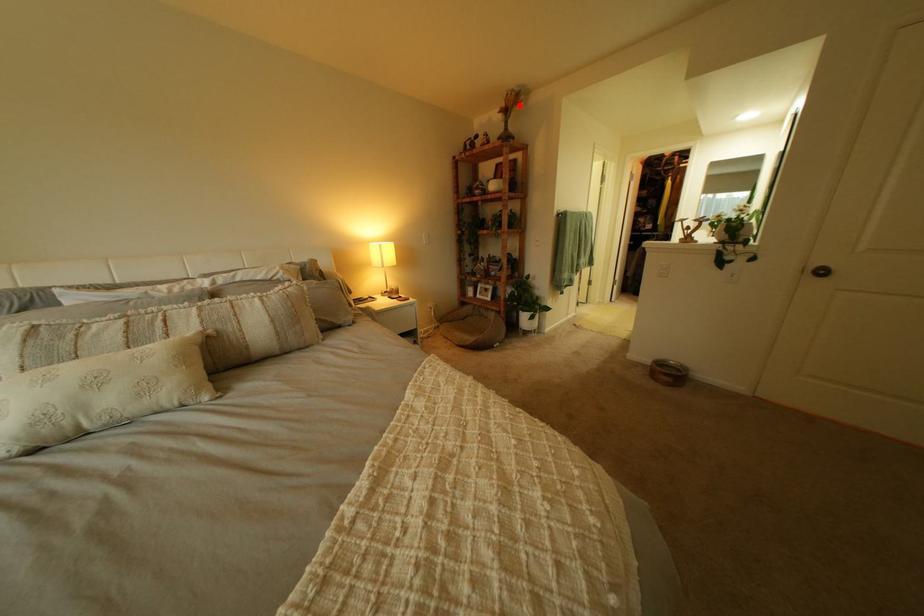
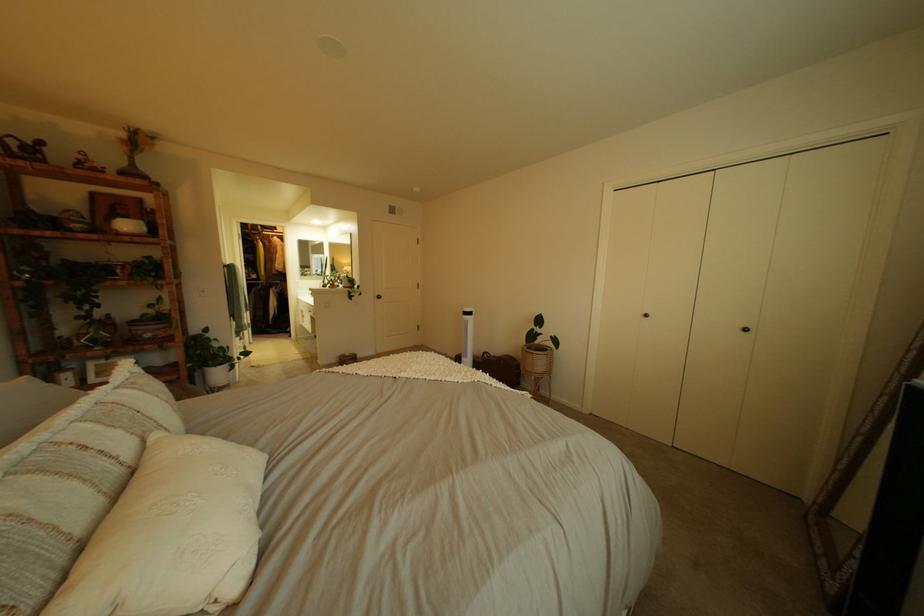
Find the pixel in the second image that matches the highlighted location in the first image.

(139, 137)